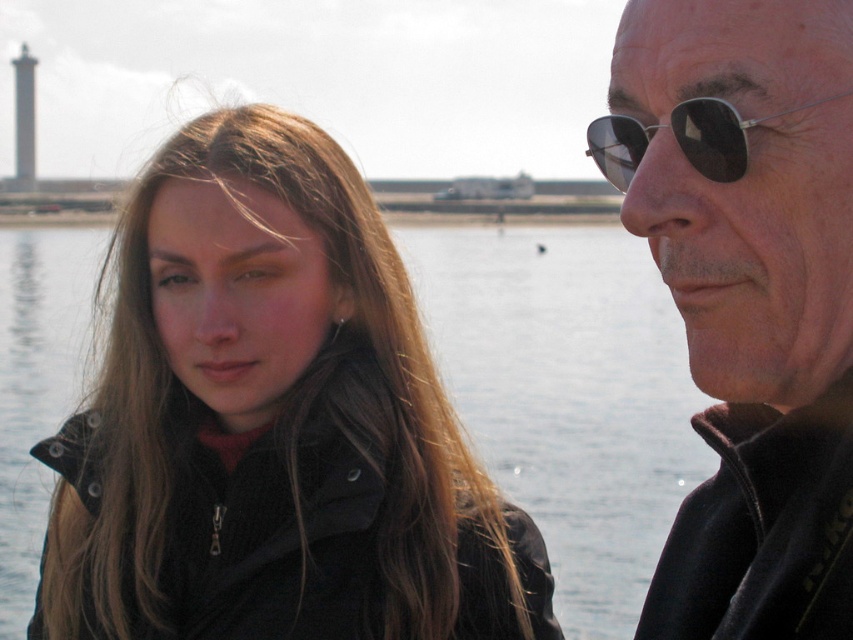
You are a photographer trying to capture the reflection of the lighthouse in the water. You notice two pairs of sunglasses in the scene. Which pair, the black matte sunglasses at upper right or the sunglasses at right, is positioned lower in the frame to better reflect in the water?

The black matte sunglasses at upper right is below sunglasses at right, so it is positioned lower in the frame and would better reflect in the water.